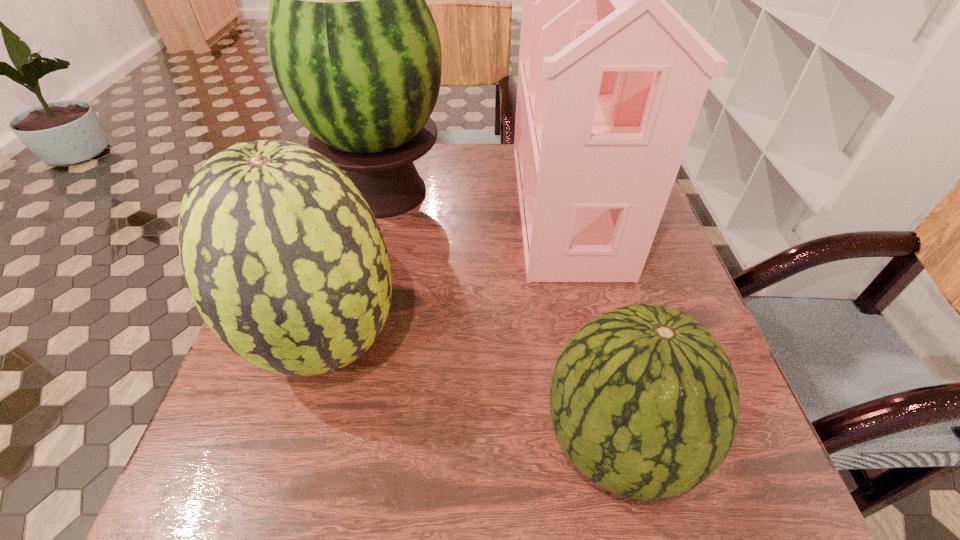
Where is `dollhouse`? dollhouse is located at coordinates (609, 90).

At what (x,y) coordinates should I click in order to perform the action: click on the farthest watermelon. Please return your answer as a coordinate pair (x, y). This screenshot has height=540, width=960. Looking at the image, I should click on (353, 46).

Locate an element on the screen. The image size is (960, 540). the third tallest object is located at coordinates (283, 257).

I want to click on the rightmost watermelon, so click(644, 401).

Locate an element on the screen. Image resolution: width=960 pixels, height=540 pixels. the shortest object is located at coordinates (644, 401).

Identify the location of vacant area situated on the front-facing side of the dollhouse. (418, 205).

Identify the location of vacant position located 0.160m on the front-facing side of the dollhouse. The width and height of the screenshot is (960, 540). (450, 205).

At what (x,y) coordinates should I click in order to perform the action: click on free space located on the front-facing side of the dollhouse. Please return your answer as a coordinate pair (x, y). Looking at the image, I should click on (483, 205).

I want to click on free space located 0.080m on the back of the farthest watermelon, so click(x=396, y=144).

In order to click on free spot located 0.370m on the back of the second shortest watermelon in this screenshot , I will do `click(373, 181)`.